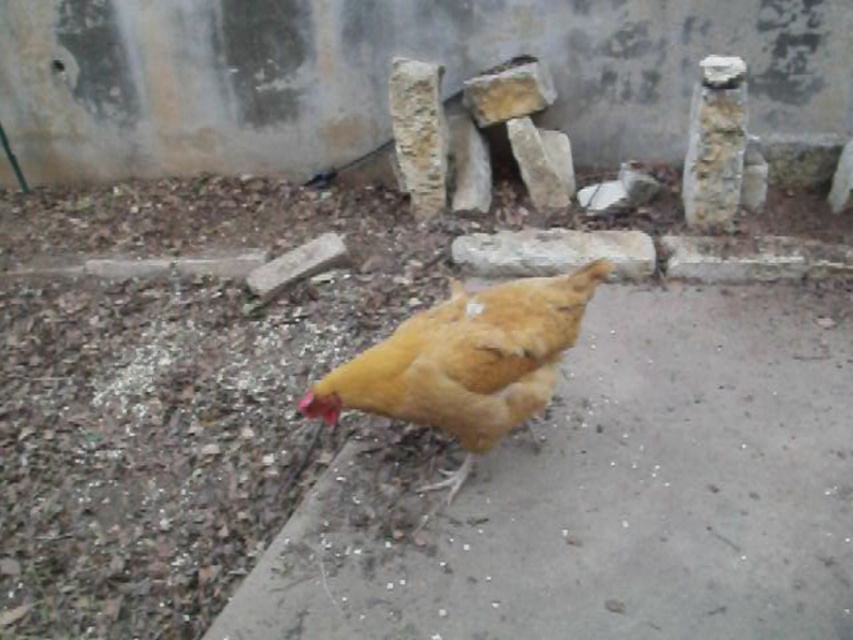
Question: Does yellow feathered chicken at center have a lesser width compared to golden feathered chicken at center?

Choices:
 (A) yes
 (B) no

Answer: (B)

Question: Does yellow feathered chicken at center have a lesser width compared to golden feathered chicken at center?

Choices:
 (A) yes
 (B) no

Answer: (B)

Question: Which point is farther to the camera?

Choices:
 (A) (526, 280)
 (B) (492, 243)
 (C) (804, 600)

Answer: (B)

Question: Can you confirm if yellow feathered chicken at center is smaller than rough stone at center?

Choices:
 (A) yes
 (B) no

Answer: (B)

Question: Among these points, which one is farthest from the camera?

Choices:
 (A) (547, 228)
 (B) (426, 324)
 (C) (737, 532)

Answer: (A)

Question: Which point is closer to the camera?

Choices:
 (A) (473, 458)
 (B) (827, 364)
 (C) (532, 256)

Answer: (A)